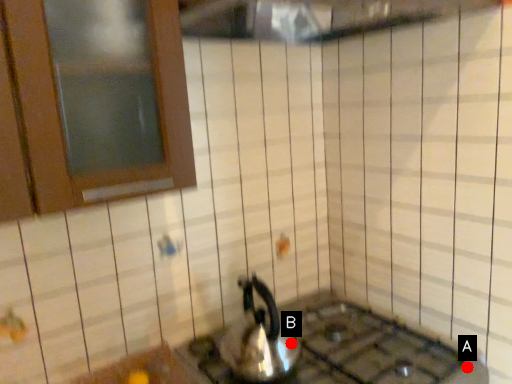
Question: Two points are circled on the image, labeled by A and B beside each circle. Which point is farther from the camera taking this photo?

Choices:
 (A) A is further
 (B) B is further

Answer: (B)